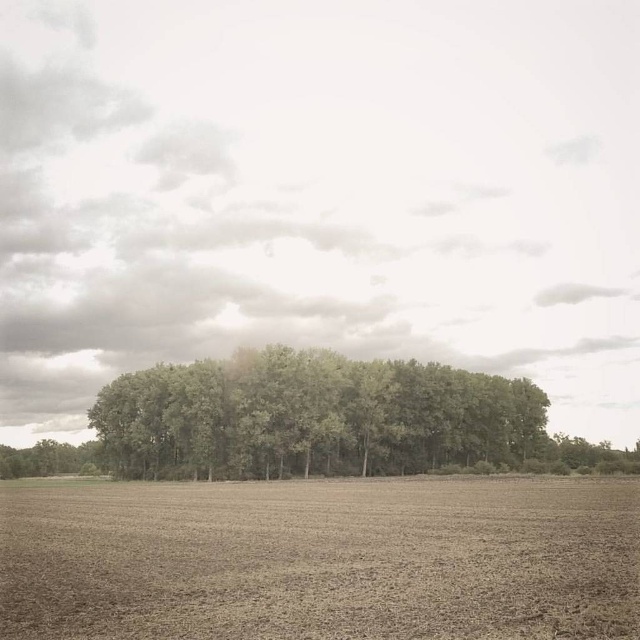
Can you confirm if brown soil at center is positioned to the right of green leafy trees at center?

No, brown soil at center is not to the right of green leafy trees at center.

Between brown soil at center and green leafy trees at center, which one appears on the right side from the viewer's perspective?

From the viewer's perspective, green leafy trees at center appears more on the right side.

I want to click on brown soil at center, so click(x=321, y=560).

You are a GUI agent. You are given a task and a screenshot of the screen. Output one action in this format:
    pyautogui.click(x=<x>, y=<y>)
    Task: Click on the brown soil at center
    This screenshot has width=640, height=640.
    Given the screenshot: What is the action you would take?
    pyautogui.click(x=321, y=560)